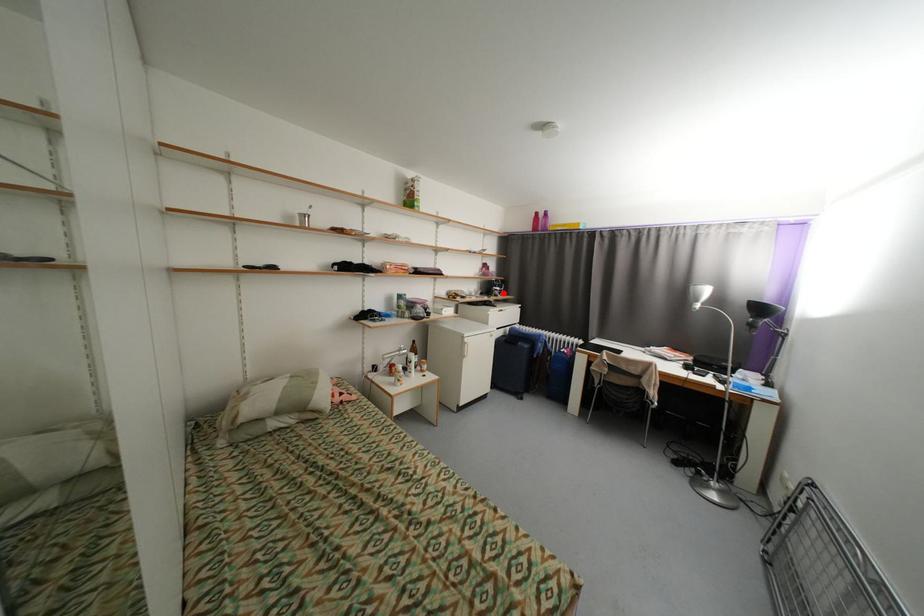
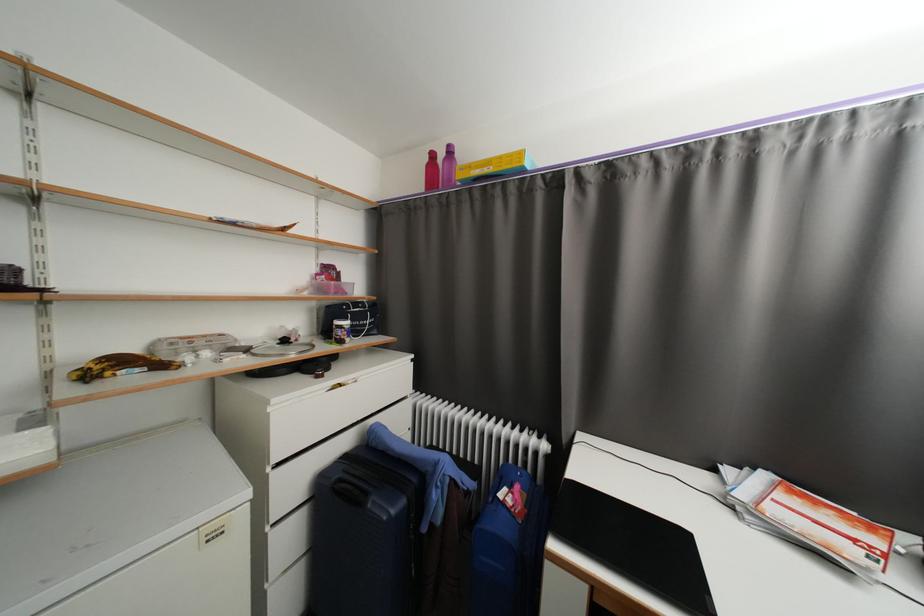
The point at the highlighted location is marked in the first image. Where is the corresponding point in the second image?

(346, 334)